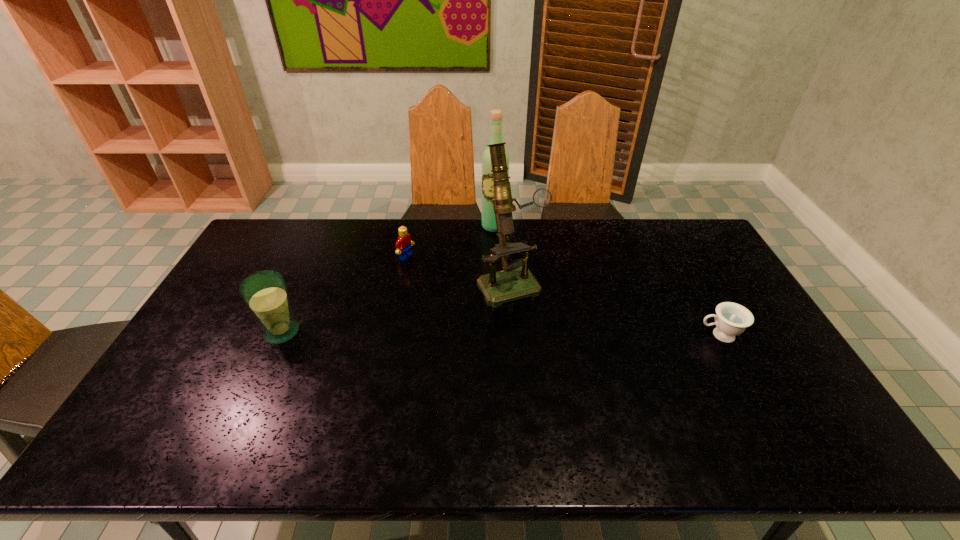
The image size is (960, 540). I want to click on glass, so click(x=265, y=293).

At what (x,y) coordinates should I click in order to perform the action: click on the leftmost object. Please return your answer as a coordinate pair (x, y). Image resolution: width=960 pixels, height=540 pixels. Looking at the image, I should click on (265, 293).

What are the coordinates of `teacup` in the screenshot? It's located at (731, 319).

The height and width of the screenshot is (540, 960). Identify the location of the shortest object. (731, 319).

At what (x,y) coordinates should I click in order to perform the action: click on Lego. Please return your answer as a coordinate pair (x, y). Looking at the image, I should click on (403, 245).

What are the coordinates of `the fourth tallest object` in the screenshot? It's located at (403, 245).

This screenshot has height=540, width=960. Identify the location of the farthest object. (488, 216).

In order to click on microscope in this screenshot , I will do `click(515, 281)`.

At what (x,y) coordinates should I click in order to perform the action: click on vacant area located on the right of the leftmost object. Please return your answer as a coordinate pair (x, y). This screenshot has height=540, width=960. Looking at the image, I should click on (415, 332).

Locate an element on the screen. This screenshot has width=960, height=540. free region located 0.180m on the side of the shortest object with the handle is located at coordinates (635, 335).